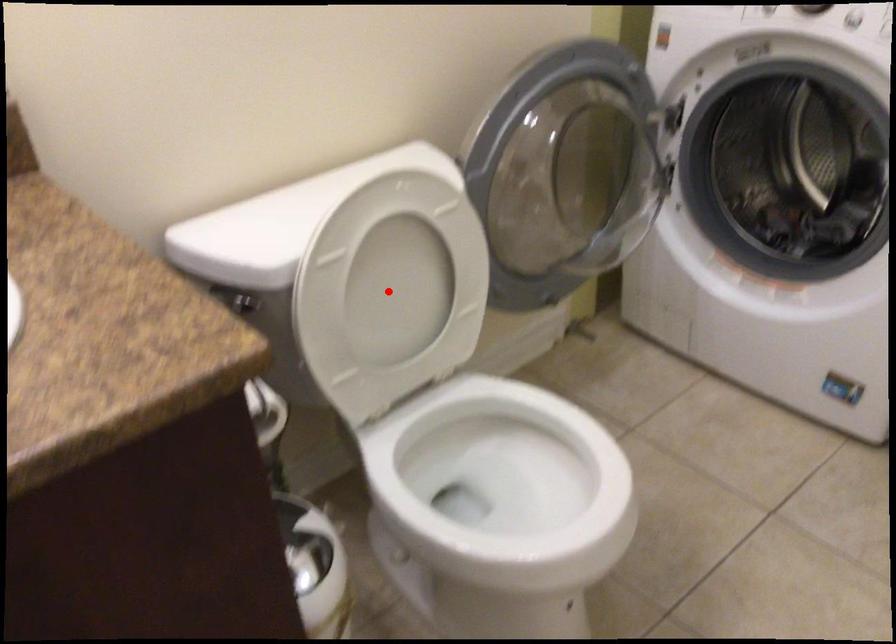
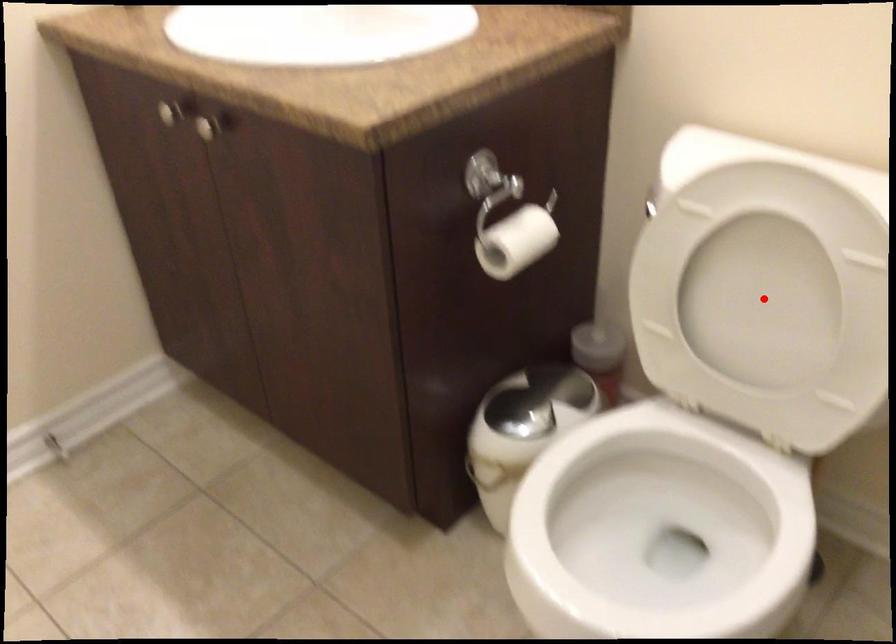
I am providing you with two images of the same scene from different viewpoints. A red point is marked on the first image and another point is marked on the second image. Do the highlighted points in image1 and image2 indicate the same real-world spot?

Yes